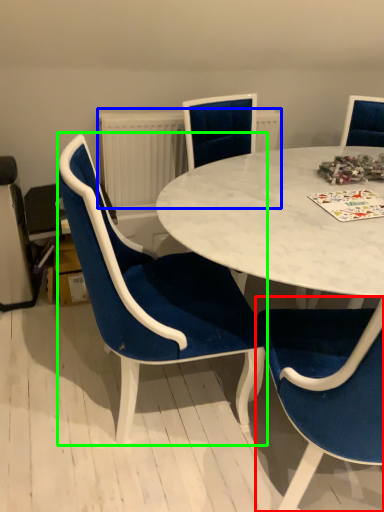
Question: Estimate the real-world distances between objects in this image. Which object is closer to chair (highlighted by a red box), radiator (highlighted by a blue box) or chair (highlighted by a green box)?

Choices:
 (A) radiator
 (B) chair

Answer: (B)